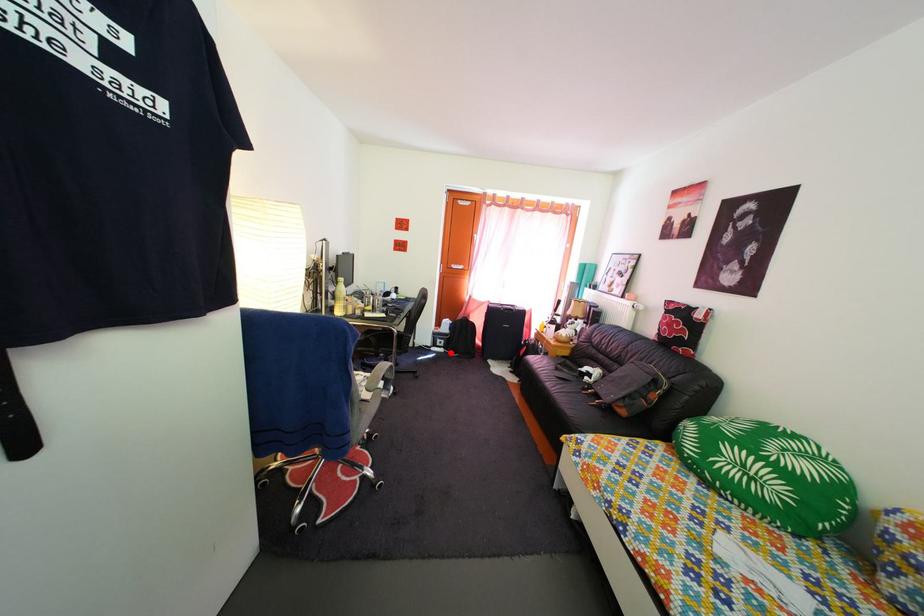
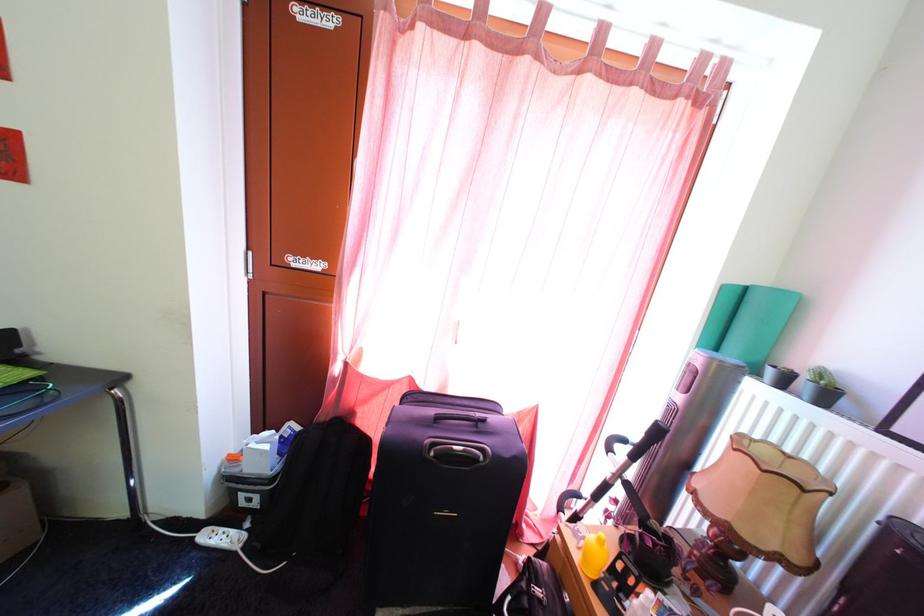
Question: I am providing you with two images of the same scene from different viewpoints. In image1, a red point is highlighted. Considering the same 3D point in image2, which of the following is correct?

Choices:
 (A) It is closer
 (B) It is farther

Answer: (A)